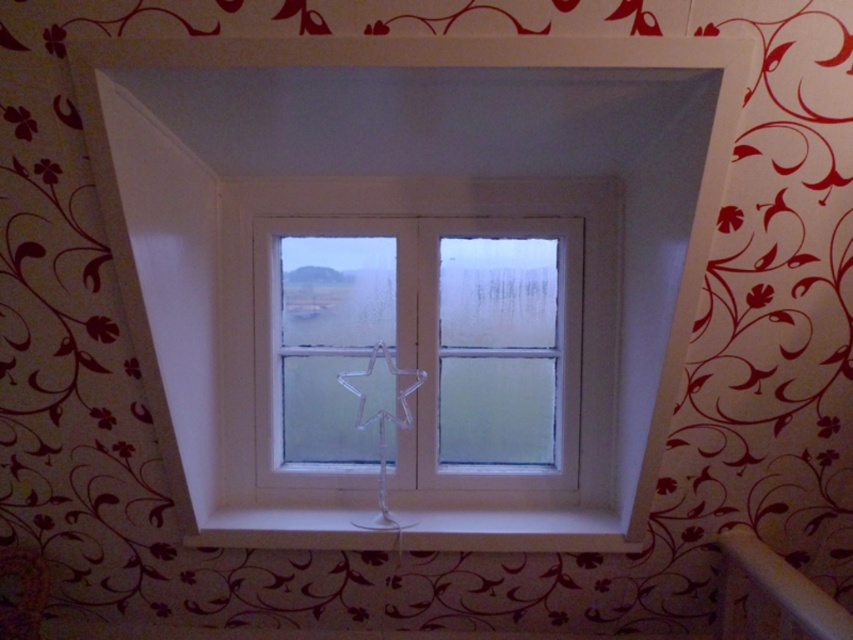
Question: Estimate the real-world distances between objects in this image. Which object is closer to the white glossy shelf at lower center?

Choices:
 (A) frosted glass window at center
 (B) white plastic window frame at center

Answer: (A)

Question: Which object appears farthest from the camera in this image?

Choices:
 (A) white glossy shelf at lower center
 (B) white plastic window frame at center
 (C) frosted glass window at center

Answer: (C)

Question: Which point appears farthest from the camera in this image?

Choices:
 (A) (833, 620)
 (B) (198, 241)

Answer: (B)

Question: Can you confirm if white plastic window frame at center is positioned to the right of white glossy shelf at lower center?

Choices:
 (A) yes
 (B) no

Answer: (B)

Question: Is white plastic window frame at center closer to camera compared to frosted glass window at center?

Choices:
 (A) no
 (B) yes

Answer: (B)

Question: Is frosted glass window at center smaller than white glossy balustrade at lower right?

Choices:
 (A) no
 (B) yes

Answer: (A)